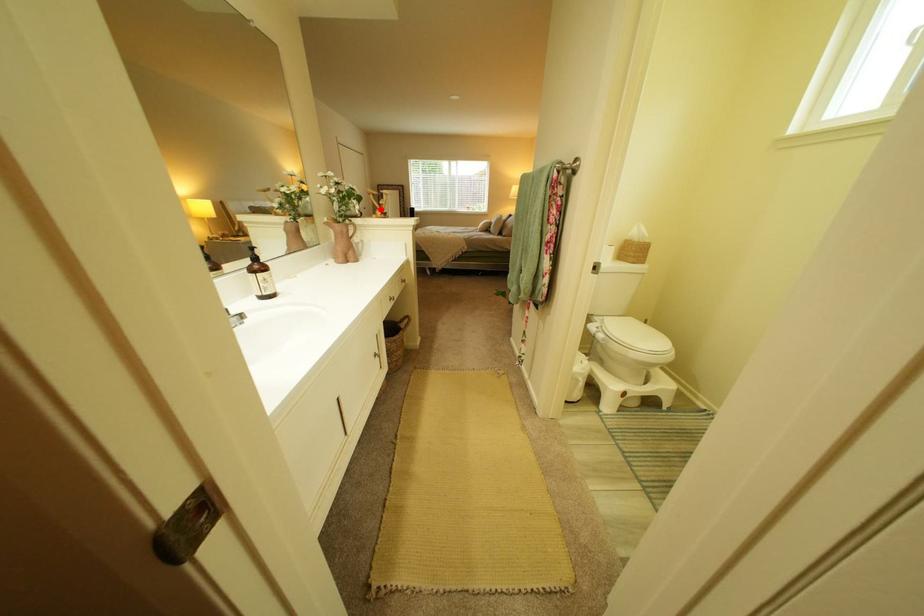
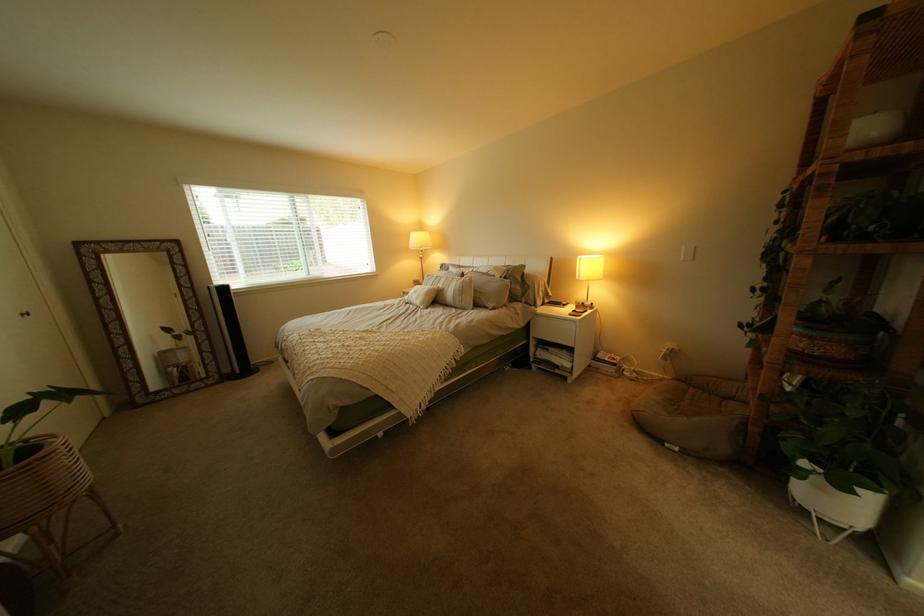
Find the pixel in the second image that matches the highlighted location in the first image.

(42, 315)